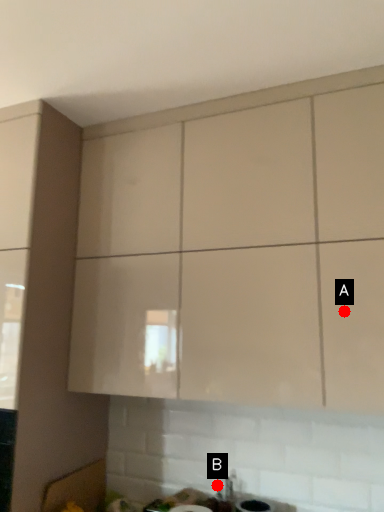
Question: Two points are circled on the image, labeled by A and B beside each circle. Which point is closer to the camera taking this photo?

Choices:
 (A) A is closer
 (B) B is closer

Answer: (A)